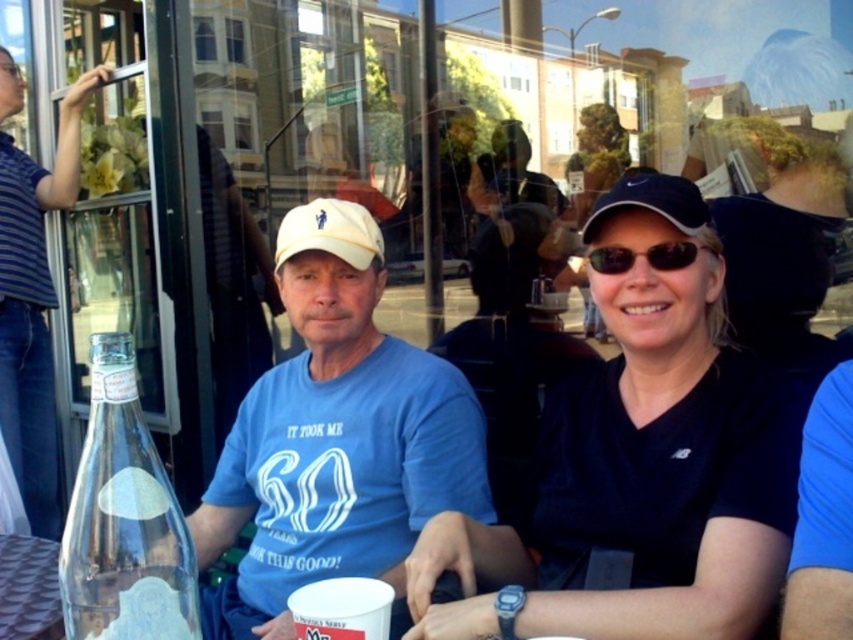
You are a photographer trying to capture a clear shot of both the blue striped shirt at left and the blue matte baseball cap at upper right. Considering their sizes, which object would you need to focus on first to ensure both are in frame?

The blue striped shirt at left is much taller than the blue matte baseball cap at upper right, so you should focus on the blue striped shirt at left first to ensure both fit within the frame.

You are a photographer trying to capture a photo of the two people at the table. You want to ensure both the white fabric baseball cap at center and the sunglasses at center are visible in the frame. Based on their positions, which object is closer to the left edge of the photo?

The white fabric baseball cap at center is to the left of sunglasses at center, so it is closer to the left edge of the photo.